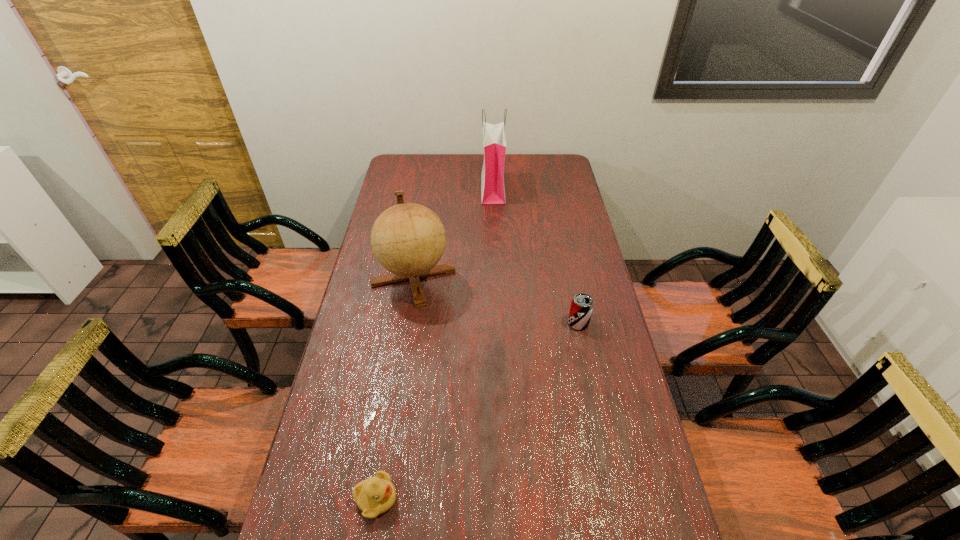
Where is `empty space between the nearest object and the second farthest object`? empty space between the nearest object and the second farthest object is located at coordinates (395, 388).

This screenshot has height=540, width=960. What are the coordinates of `vacant region between the globe and the soda can` in the screenshot? It's located at (495, 300).

Locate an element on the screen. vacant space in between the duckling and the farthest object is located at coordinates (435, 344).

Find the location of a particular element. Image resolution: width=960 pixels, height=540 pixels. free space between the globe and the farthest object is located at coordinates (453, 233).

Image resolution: width=960 pixels, height=540 pixels. Identify the location of vacant space in between the second shortest object and the shortest object. (477, 411).

At what (x,y) coordinates should I click in order to perform the action: click on vacant space that is in between the nearest object and the soda can. Please return your answer as a coordinate pair (x, y). Looking at the image, I should click on (477, 411).

Identify the location of free spot between the nearest object and the third farthest object. (477, 411).

Image resolution: width=960 pixels, height=540 pixels. Find the location of `free space between the nearest object and the rightmost object`. free space between the nearest object and the rightmost object is located at coordinates coord(477,411).

In order to click on vacant region between the second shortest object and the second object from right to left in this screenshot , I will do `click(536, 256)`.

At what (x,y) coordinates should I click in order to perform the action: click on vacant area between the shopping bag and the rightmost object. Please return your answer as a coordinate pair (x, y). Looking at the image, I should click on [536, 256].